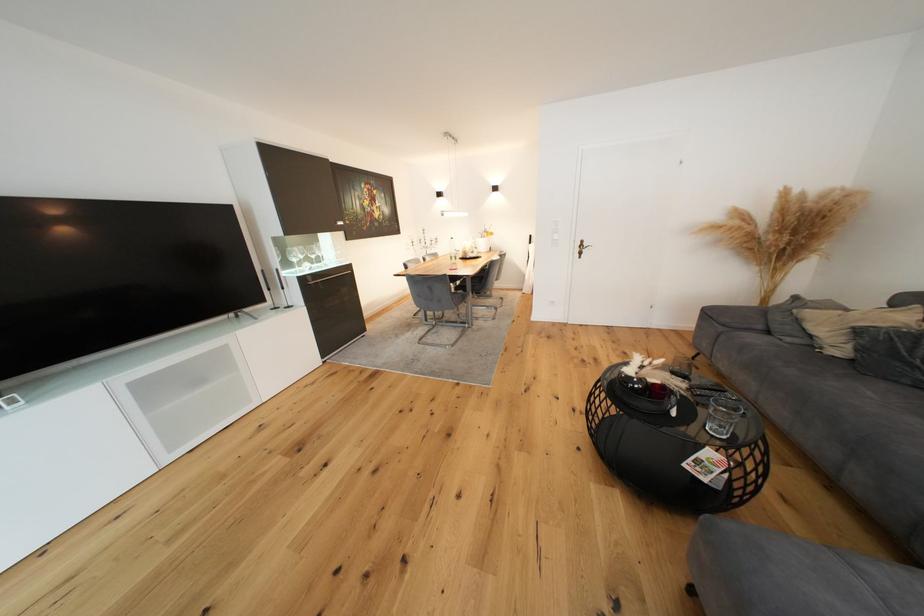
Where would you lift the clear drinking glass? Please return your answer as a coordinate pair (x, y).

(723, 416)